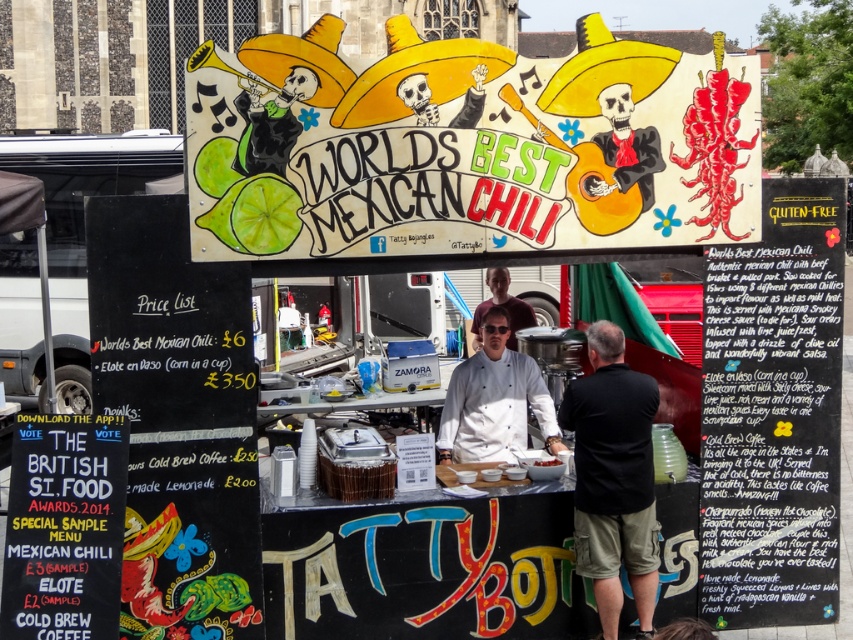
You are a customer at the food stall and want to order the chili. The vendor is wearing a white chef coat at center, and there is a matte white bowl at center on the counter. Which item is bigger in size?

The white chef coat at center is larger in size than the matte white bowl at center.

You are a customer at the food stall and want to place your matte white bowl at center on the counter near the white chef coat at center. The bowl is 0.5 meters in diameter. Is there enough space between them to place the bowl?

The white chef coat at center and matte white bowl at center are 3.93 meters apart, so there is sufficient space to place the bowl as the distance between them is much larger than the bowl diameter.

You are a customer at the food stall and want to ask the chef about the chili recipe. The chef is wearing both a black cotton shirt at center and a white chef coat at center. Which piece of clothing should you point to first to get their attention?

You should point to the black cotton shirt at center first because it is in front of the white chef coat at center, making it more visible to you.